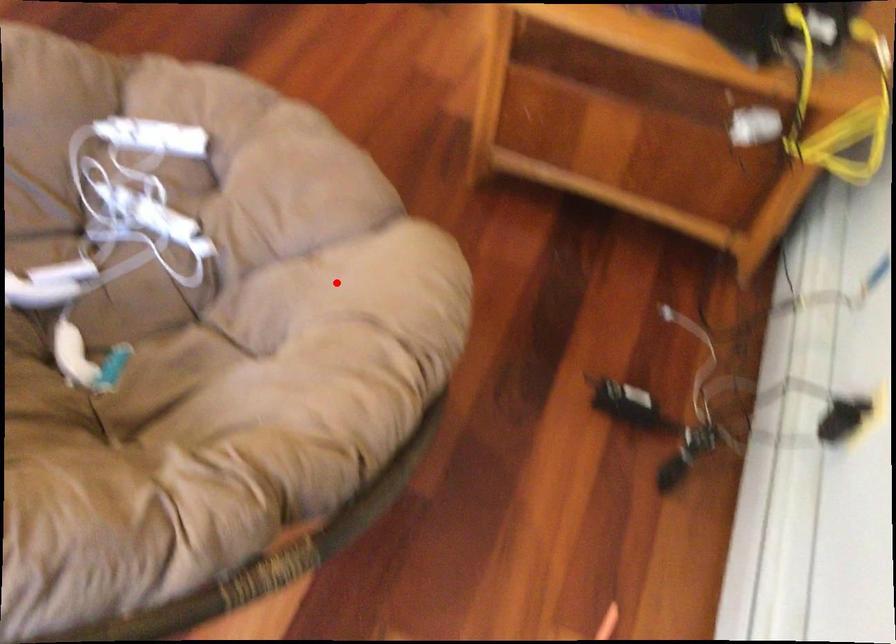
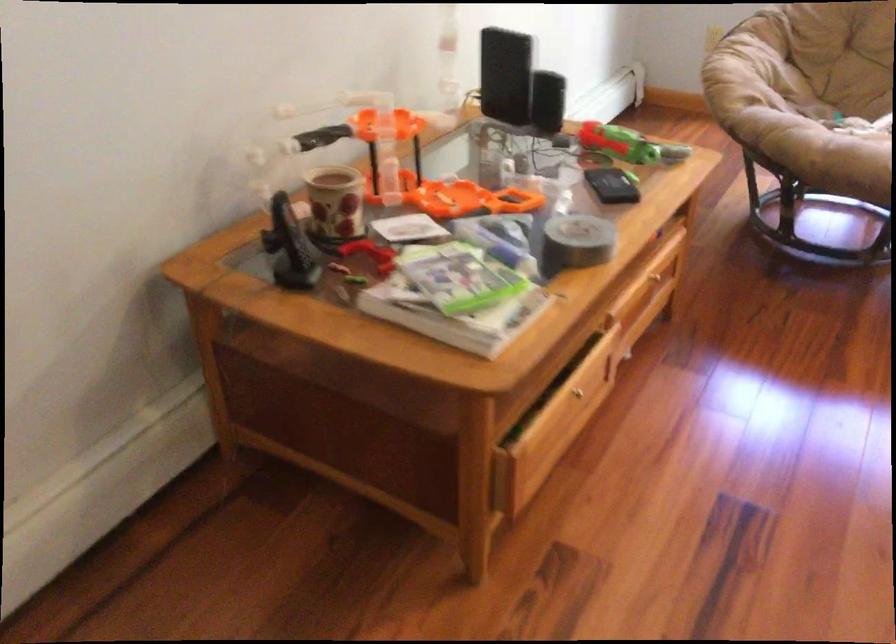
Question: I am providing you with two images of the same scene from different viewpoints. A red point is shown in image1. For the corresponding object point in image2, is it positioned nearer or farther from the camera?

Choices:
 (A) Nearer
 (B) Farther

Answer: (B)